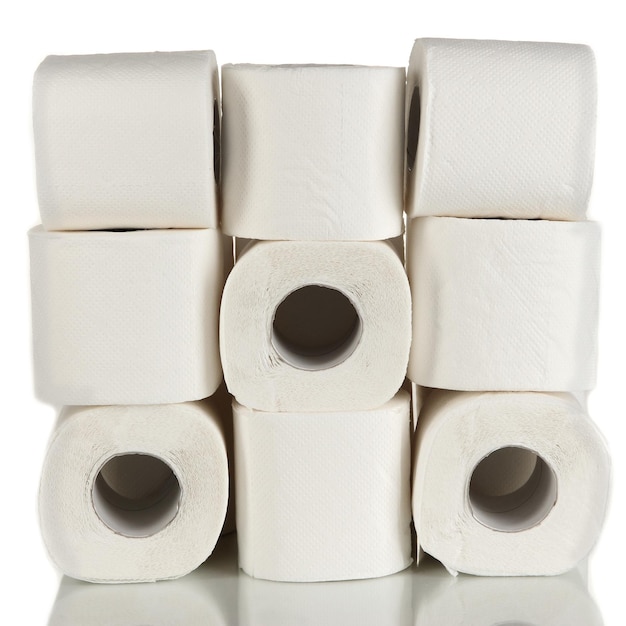
Image resolution: width=626 pixels, height=626 pixels. Identify the location of toilet paper rolls. 155,188, 151,316, 151,452, 272,471, 299,342, 332,193, 476,111, 500,277, 506,459.